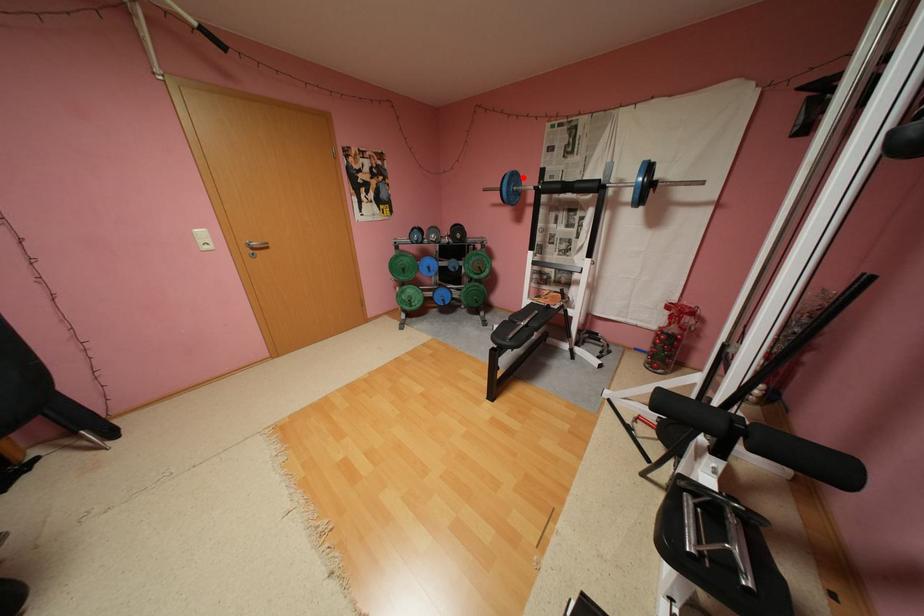
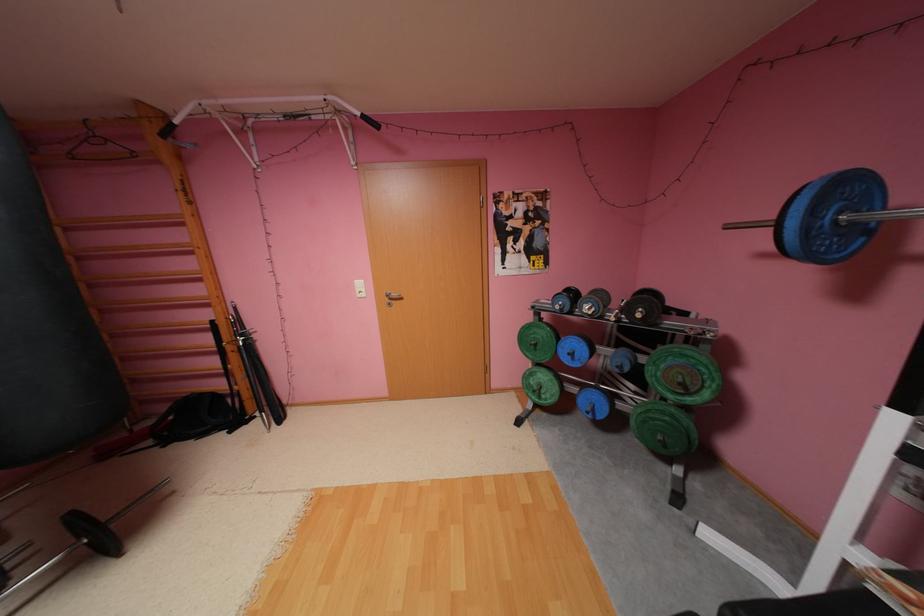
Where in the second image is the point corresponding to the highlighted location from the first image?

(855, 188)